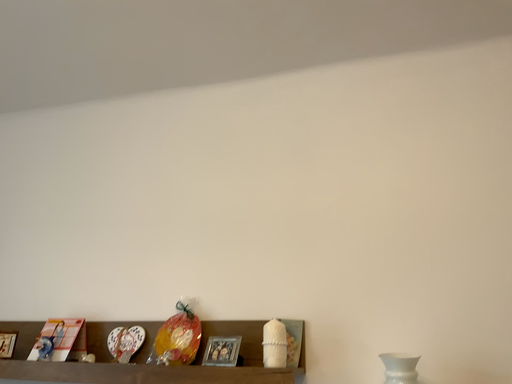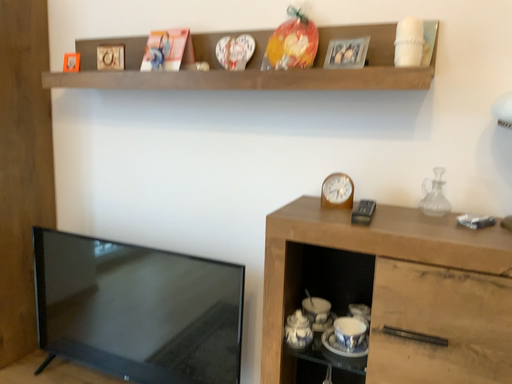
Question: Which way did the camera rotate in the video?

Choices:
 (A) rotated right
 (B) rotated left

Answer: (B)